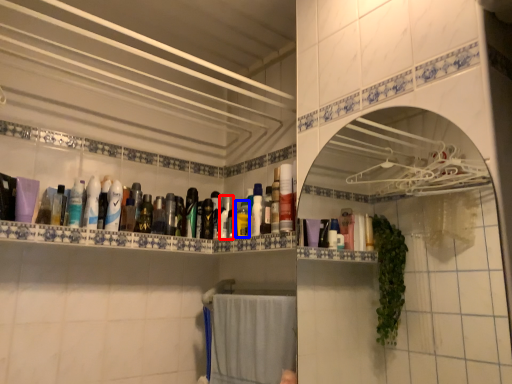
Question: Among these objects, which one is nearest to the camera, toiletry (highlighted by a red box) or mouthwash (highlighted by a blue box)?

Choices:
 (A) toiletry
 (B) mouthwash

Answer: (B)